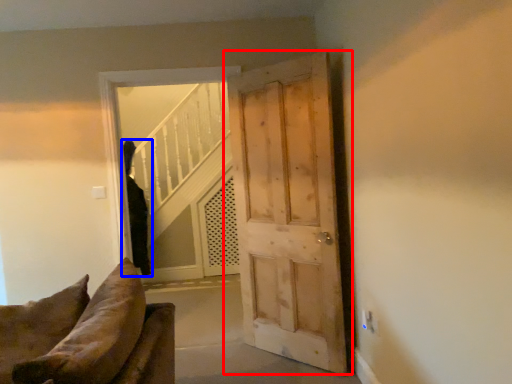
Question: Which of the following is the closest to the observer, door (highlighted by a red box) or person (highlighted by a blue box)?

Choices:
 (A) door
 (B) person

Answer: (A)